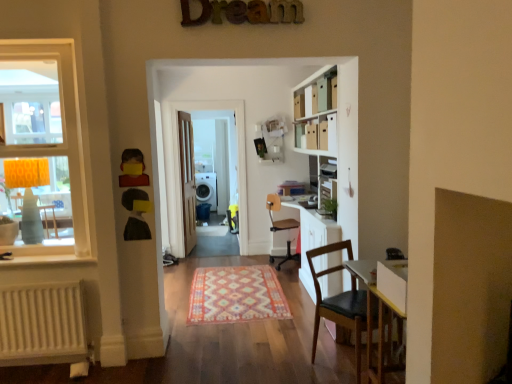
Locate an element on the screen. This screenshot has width=512, height=384. free point above multicolored woven rug at center (from a real-world perspective) is located at coordinates [x=239, y=292].